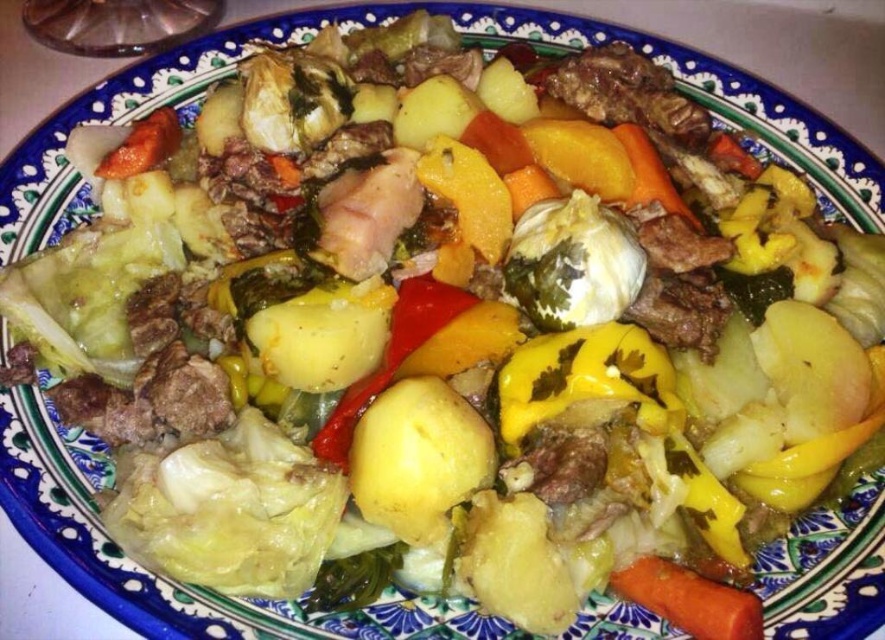
Question: Is green leafy cabbage at center smaller than orange smooth carrot at lower right?

Choices:
 (A) yes
 (B) no

Answer: (B)

Question: Which of the following is the closest to the observer?

Choices:
 (A) orange smooth carrot at upper left
 (B) yellow matte potato at center
 (C) orange smooth carrot at lower right
 (D) orange smooth carrot at center

Answer: (B)

Question: From the image, what is the correct spatial relationship of green leafy cabbage at center in relation to orange smooth carrot at center?

Choices:
 (A) below
 (B) above

Answer: (A)

Question: Which point is closer to the camera?

Choices:
 (A) (389, 397)
 (B) (660, 195)
 (C) (743, 621)

Answer: (C)

Question: Does green leafy cabbage at center lie behind light brown meat at center?

Choices:
 (A) yes
 (B) no

Answer: (B)

Question: Which of the following is the closest to the observer?

Choices:
 (A) orange smooth carrot at center
 (B) light brown meat at center

Answer: (B)